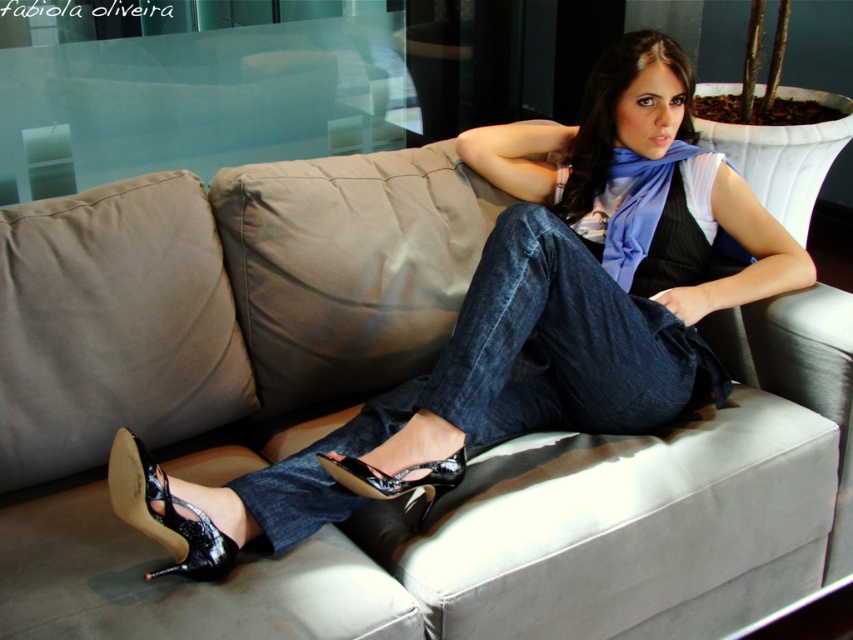
Question: Is shiny black sandal at lower left below shiny black sandal at lower center?

Choices:
 (A) no
 (B) yes

Answer: (B)

Question: Where is denim at center located in relation to shiny black sandal at lower center in the image?

Choices:
 (A) above
 (B) below

Answer: (A)

Question: Is shiny black sandal at lower left wider than shiny black sandal at lower center?

Choices:
 (A) yes
 (B) no

Answer: (B)

Question: Which object appears farthest from the camera in this image?

Choices:
 (A) shiny black sandal at lower center
 (B) denim at center

Answer: (B)

Question: Which point is farther to the camera?

Choices:
 (A) (283, 481)
 (B) (186, 540)

Answer: (A)

Question: Which object is positioned closest to the shiny black sandal at lower center?

Choices:
 (A) denim at center
 (B) shiny black sandal at lower left

Answer: (A)